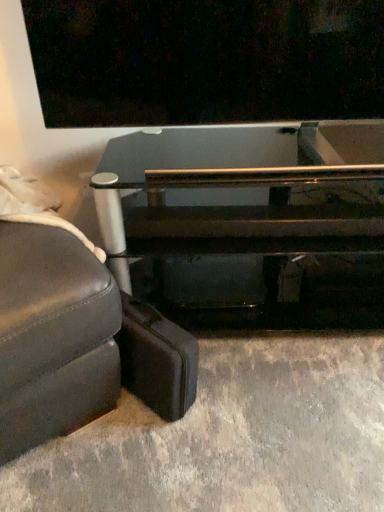
Question: From a real-world perspective, is transparent glass table at center positioned under leather studio couch at lower left based on gravity?

Choices:
 (A) no
 (B) yes

Answer: (A)

Question: From the image's perspective, is transparent glass table at center under leather studio couch at lower left?

Choices:
 (A) no
 (B) yes

Answer: (A)

Question: Is transparent glass table at center positioned before leather studio couch at lower left?

Choices:
 (A) no
 (B) yes

Answer: (A)

Question: From a real-world perspective, does transparent glass table at center stand above leather studio couch at lower left?

Choices:
 (A) yes
 (B) no

Answer: (A)

Question: Does transparent glass table at center have a greater width compared to leather studio couch at lower left?

Choices:
 (A) no
 (B) yes

Answer: (A)

Question: Can you confirm if transparent glass table at center is thinner than leather studio couch at lower left?

Choices:
 (A) yes
 (B) no

Answer: (A)

Question: Is leather studio couch at lower left behind transparent glass table at center?

Choices:
 (A) no
 (B) yes

Answer: (A)

Question: Can you confirm if leather studio couch at lower left is taller than transparent glass table at center?

Choices:
 (A) no
 (B) yes

Answer: (A)

Question: Are leather studio couch at lower left and transparent glass table at center located far from each other?

Choices:
 (A) yes
 (B) no

Answer: (B)

Question: Considering the relative sizes of leather studio couch at lower left and transparent glass table at center in the image provided, is leather studio couch at lower left shorter than transparent glass table at center?

Choices:
 (A) no
 (B) yes

Answer: (B)

Question: From the image's perspective, is leather studio couch at lower left beneath transparent glass table at center?

Choices:
 (A) yes
 (B) no

Answer: (A)

Question: Could you tell me if leather studio couch at lower left is turned towards transparent glass table at center?

Choices:
 (A) yes
 (B) no

Answer: (B)

Question: Could you tell me if leather studio couch at lower left is facing leather suitcase at lower left?

Choices:
 (A) yes
 (B) no

Answer: (B)